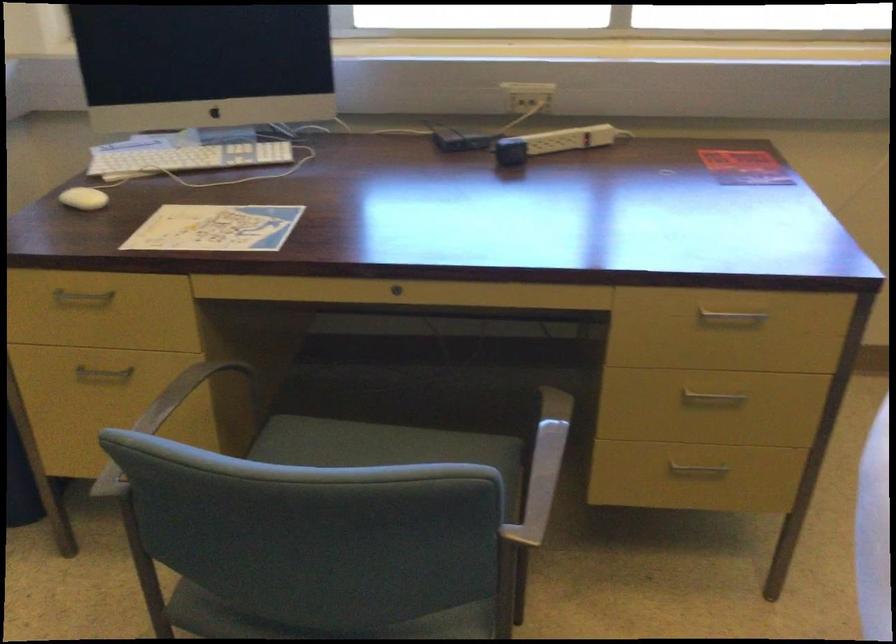
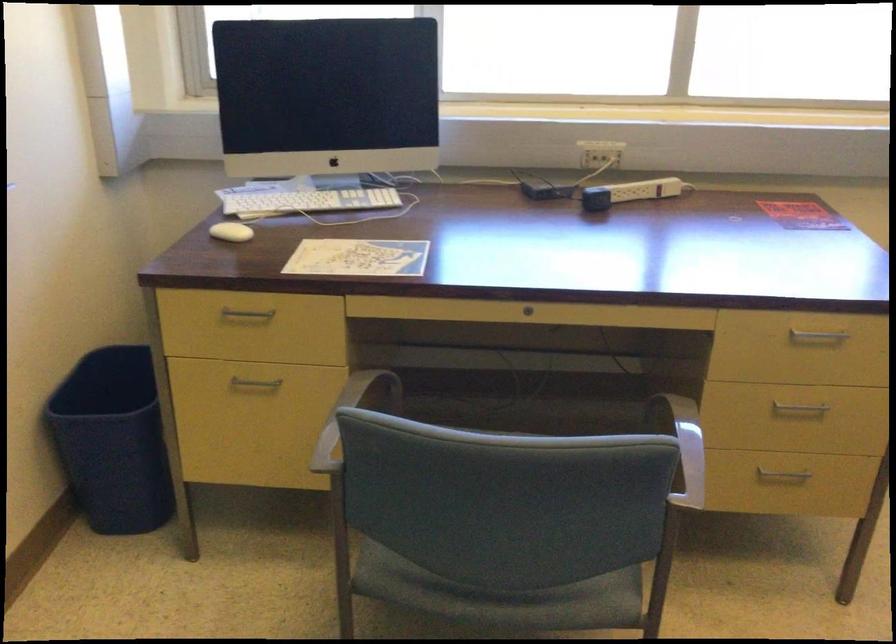
In the second image, find the point that corresponds to (82,297) in the first image.

(247, 313)